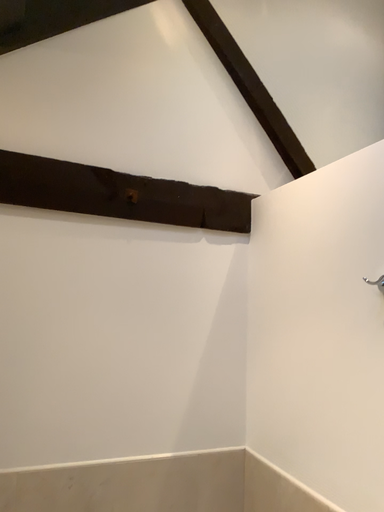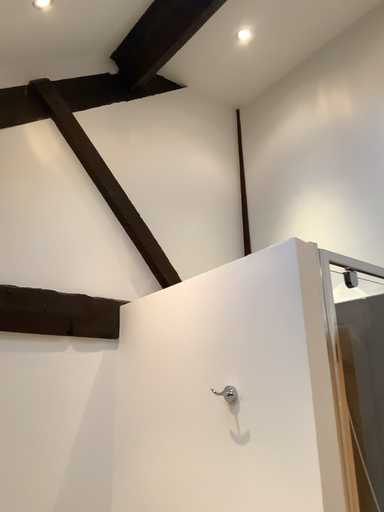
Question: Which way did the camera rotate in the video?

Choices:
 (A) rotated upward
 (B) rotated downward

Answer: (A)